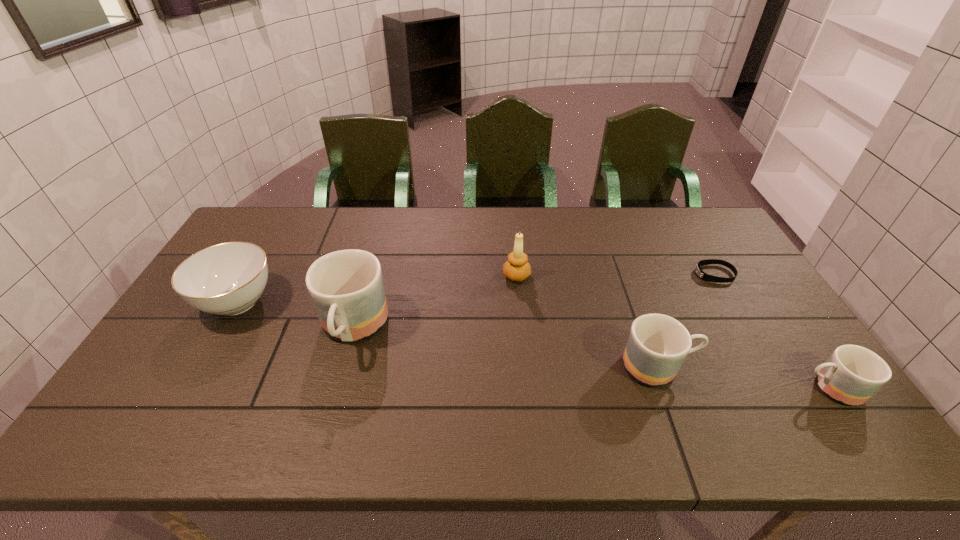
Locate an element on the screen. This screenshot has height=540, width=960. free space located 0.210m on the side with the handle of the second mug from right to left is located at coordinates (777, 367).

What are the coordinates of `free space located 0.180m on the side with the handle of the rightmost mug` in the screenshot? It's located at (727, 388).

You are a GUI agent. You are given a task and a screenshot of the screen. Output one action in this format:
    pyautogui.click(x=<x>, y=<y>)
    Task: Click on the vacant space located 0.140m on the side with the handle of the rightmost mug
    The image size is (960, 540).
    Given the screenshot: What is the action you would take?
    pyautogui.click(x=743, y=388)

Locate an element on the screen. The image size is (960, 540). vacant space situated 0.150m on the side with the handle of the rightmost mug is located at coordinates (739, 388).

The height and width of the screenshot is (540, 960). Identify the location of vacant space positioned on the display of the wristband. (585, 274).

Identify the location of free location located 0.330m on the display of the wristband. The image size is (960, 540). (591, 274).

Locate an element on the screen. vacant space located 0.320m on the display of the wristband is located at coordinates point(594,274).

Locate an element on the screen. The height and width of the screenshot is (540, 960). blank space located on the right of the leftmost object is located at coordinates (399, 302).

At what (x,y) coordinates should I click in order to perform the action: click on vacant point located on the left of the candle_holder. Please return your answer as a coordinate pair (x, y). This screenshot has width=960, height=540. Looking at the image, I should click on (382, 276).

Identify the location of object at the left edge. (225, 279).